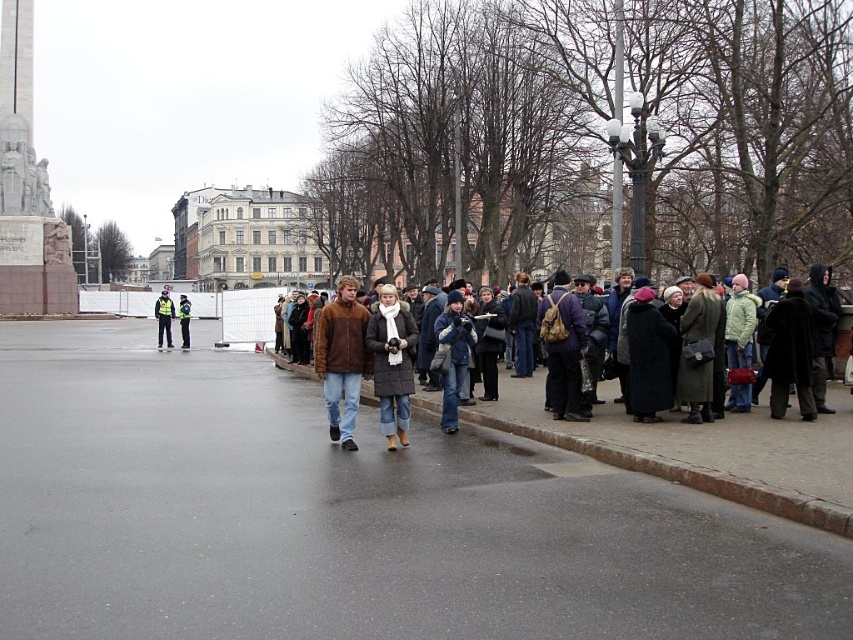
You are standing at the center of the public square and see the point marked as point (392, 362). What object is located at that point?

The point (392, 362) marks the matte brown coat at center.